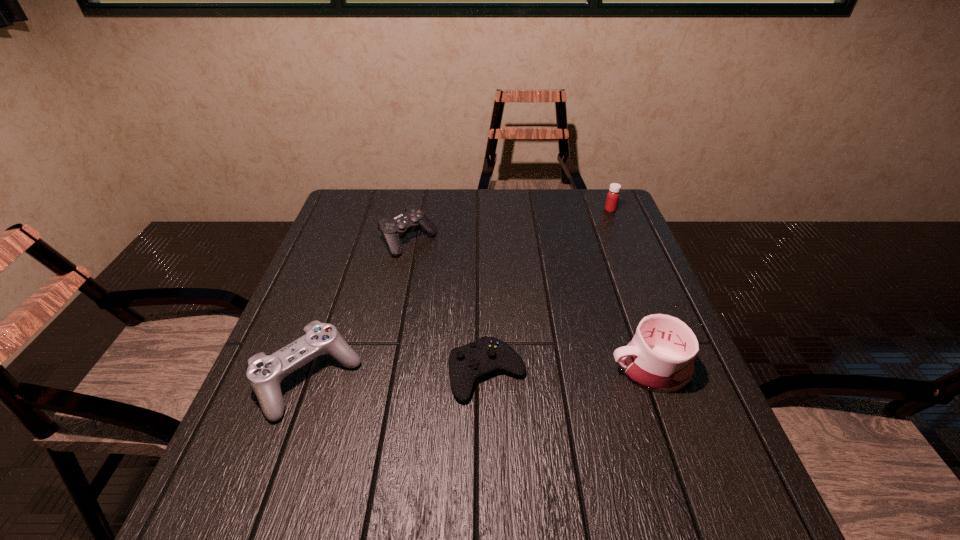
The image size is (960, 540). In order to click on mug in this screenshot , I will do `click(660, 357)`.

At what (x,y) coordinates should I click in order to perform the action: click on medicine. Please return your answer as a coordinate pair (x, y). The image size is (960, 540). Looking at the image, I should click on (613, 195).

Where is `the farthest control`? The height and width of the screenshot is (540, 960). the farthest control is located at coordinates (413, 218).

Locate an element on the screen. the rightmost control is located at coordinates (467, 364).

I want to click on the shortest control, so click(x=467, y=364).

Locate an element on the screen. This screenshot has height=540, width=960. vacant space located 0.280m on the side with the handle of the mug is located at coordinates (480, 369).

Image resolution: width=960 pixels, height=540 pixels. Find the location of `vacant area located on the side with the handle of the mug`. vacant area located on the side with the handle of the mug is located at coordinates (512, 369).

At what (x,y) coordinates should I click in order to perform the action: click on free space located 0.110m on the side with the handle of the mug. Please return your answer as a coordinate pair (x, y). Looking at the image, I should click on (559, 369).

This screenshot has width=960, height=540. I want to click on vacant region located on the front of the farthest object, so click(x=646, y=297).

The height and width of the screenshot is (540, 960). Find the location of `vacant space located on the left of the second farthest object`. vacant space located on the left of the second farthest object is located at coordinates (343, 241).